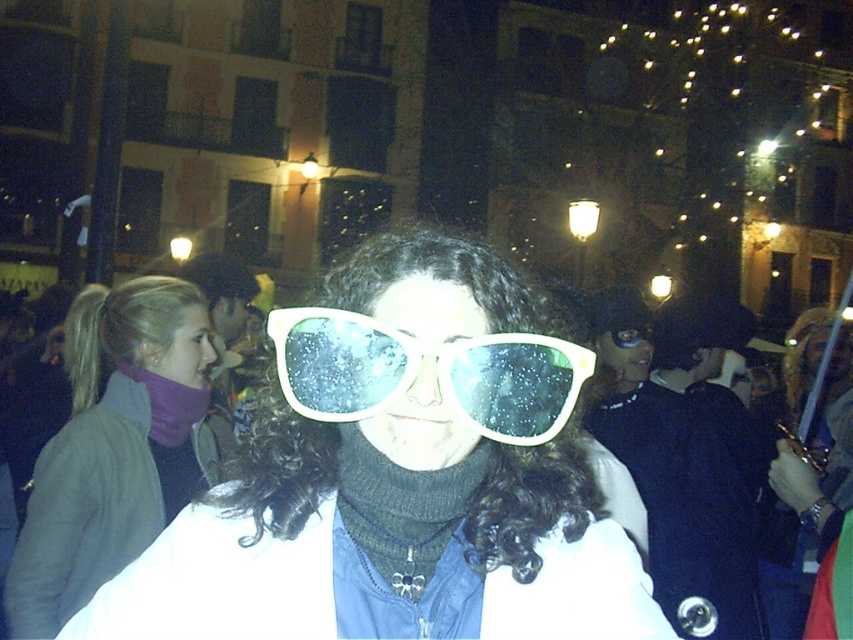
You are standing in the scene and want to locate the matte purple scarf at upper left. Based on the coordinates provided, where should you look?

The matte purple scarf at upper left is located at the coordinates point [115,445].

You are at a nighttime event and want to take a photo of both the white plastic sunglasses at center and the white plastic goggles at center. To ensure both are in the frame, which object should you position closer to the left side of your camera?

The white plastic sunglasses at center should be positioned closer to the left side of your camera since it is already to the left of the white plastic goggles at center in the scene.